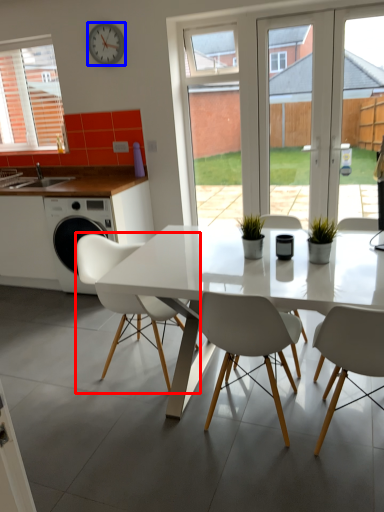
Question: Among these objects, which one is nearest to the camera, chair (highlighted by a red box) or clock (highlighted by a blue box)?

Choices:
 (A) chair
 (B) clock

Answer: (A)